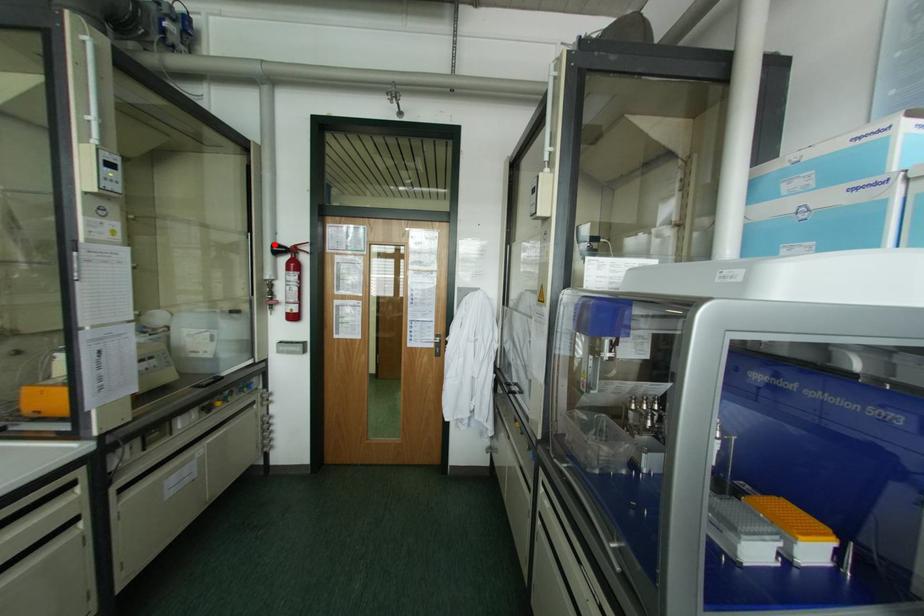
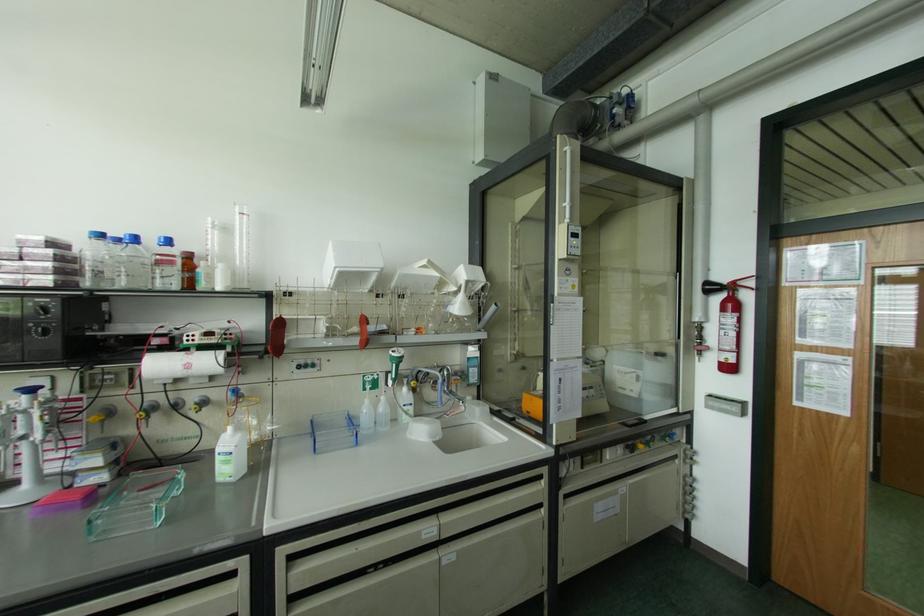
Where in the second image is the point corresponding to the highlighted location from the first image?

(707, 283)